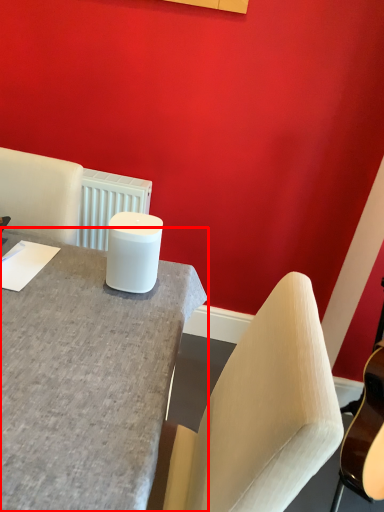
Question: From the image's perspective, where is desk (annotated by the red box) located relative to candle holder?

Choices:
 (A) above
 (B) below

Answer: (B)